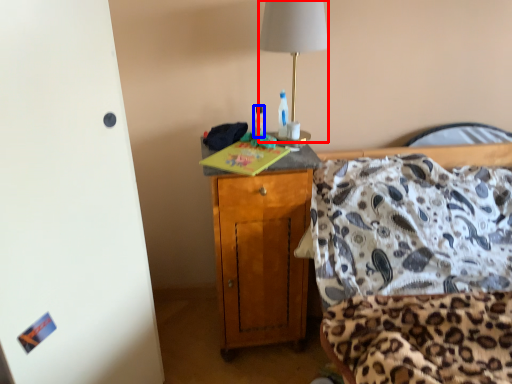
Question: Among these objects, which one is farthest to the camera, lamp (highlighted by a red box) or bottle (highlighted by a blue box)?

Choices:
 (A) lamp
 (B) bottle

Answer: (B)